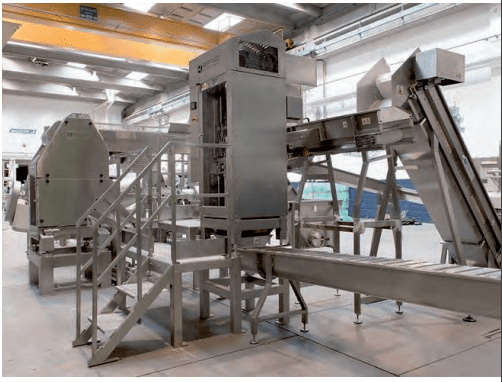
Locate an element on the screen. The width and height of the screenshot is (502, 382). metal steps is located at coordinates (132, 289), (109, 322), (164, 258).